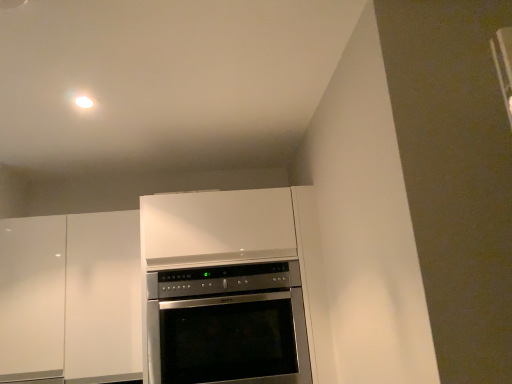
Question: From the image's perspective, does satin silver oven at center appear lower than white glossy cabinet at left?

Choices:
 (A) yes
 (B) no

Answer: (A)

Question: Could you tell me if satin silver oven at center is facing white glossy cabinet at left?

Choices:
 (A) no
 (B) yes

Answer: (A)

Question: From a real-world perspective, is satin silver oven at center located higher than white glossy cabinet at left?

Choices:
 (A) yes
 (B) no

Answer: (B)

Question: Is satin silver oven at center positioned before white glossy cabinet at left?

Choices:
 (A) no
 (B) yes

Answer: (B)

Question: From the image's perspective, is satin silver oven at center located above white glossy cabinet at left?

Choices:
 (A) yes
 (B) no

Answer: (B)

Question: Is satin silver oven at center next to white glossy cabinet at left?

Choices:
 (A) yes
 (B) no

Answer: (B)

Question: From the image's perspective, is white glossy cabinet at left on top of satin silver oven at center?

Choices:
 (A) no
 (B) yes

Answer: (B)

Question: Would you say white glossy cabinet at left is a long distance from satin silver oven at center?

Choices:
 (A) no
 (B) yes

Answer: (A)

Question: Is white glossy cabinet at left facing away from satin silver oven at center?

Choices:
 (A) yes
 (B) no

Answer: (B)

Question: Considering the relative positions of white glossy cabinet at left and satin silver oven at center in the image provided, is white glossy cabinet at left to the right of satin silver oven at center from the viewer's perspective?

Choices:
 (A) yes
 (B) no

Answer: (B)

Question: From the image's perspective, is white glossy cabinet at left located beneath satin silver oven at center?

Choices:
 (A) no
 (B) yes

Answer: (A)

Question: Is white glossy cabinet at left in front of satin silver oven at center?

Choices:
 (A) no
 (B) yes

Answer: (A)

Question: Is white glossy cabinet at left wider or thinner than satin silver oven at center?

Choices:
 (A) thin
 (B) wide

Answer: (A)